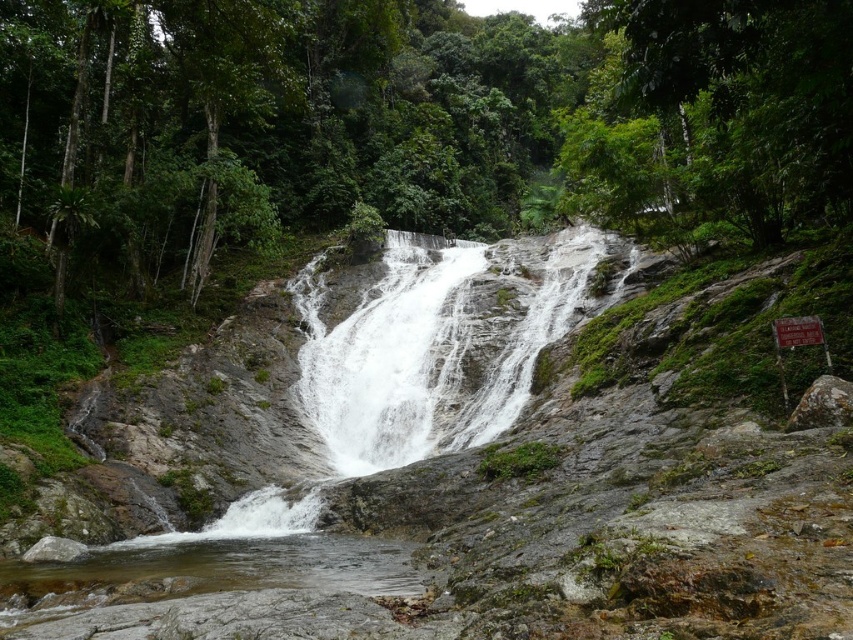
Is point (346, 401) positioned after point (819, 385)?

That is True.

Who is lower down, white textured waterfall at center or gray rough rock at right?

Positioned lower is gray rough rock at right.

Which is behind, point (292, 502) or point (822, 374)?

Point (292, 502)

At what (x,y) coordinates should I click in order to perform the action: click on white textured waterfall at center. Please return your answer as a coordinate pair (x, y). The height and width of the screenshot is (640, 853). Looking at the image, I should click on [x=408, y=369].

Does point (326, 460) come behind point (54, 557)?

Yes, it is.

What do you see at coordinates (408, 369) in the screenshot? This screenshot has width=853, height=640. I see `white textured waterfall at center` at bounding box center [408, 369].

Is point (390, 310) farther from camera compared to point (28, 556)?

Yes.

Identify the location of white textured waterfall at center. (408, 369).

Who is more distant from viewer, (836, 420) or (51, 545)?

Positioned behind is point (51, 545).

Is point (842, 419) more distant than point (35, 561)?

That is False.

Who is more forward, (831,374) or (28,557)?

Point (831,374) is in front.

Image resolution: width=853 pixels, height=640 pixels. I want to click on gray rough rock at right, so click(822, 404).